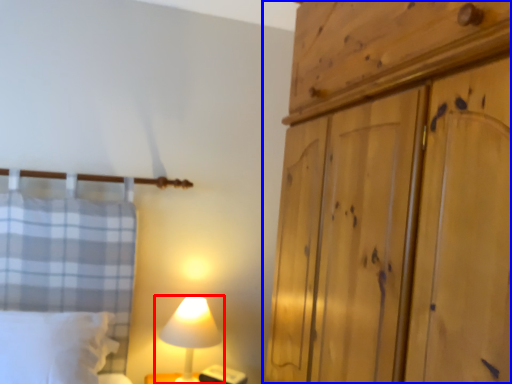
Question: Which of the following is the closest to the observer, lamp (highlighted by a red box) or cupboard (highlighted by a blue box)?

Choices:
 (A) lamp
 (B) cupboard

Answer: (B)